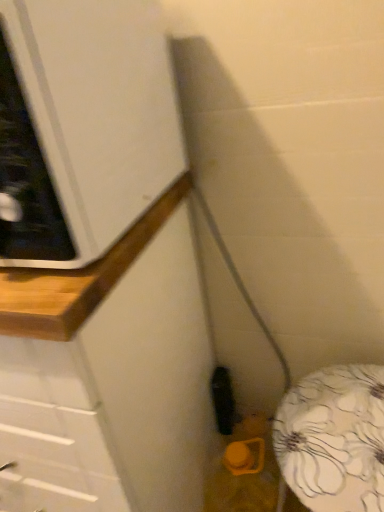
Describe the element at coordinates (109, 375) in the screenshot. I see `wooden counter at lower left` at that location.

Where is `wooden counter at lower left`? The width and height of the screenshot is (384, 512). wooden counter at lower left is located at coordinates pos(109,375).

At what (x,y) coordinates should I click in order to perform the action: click on white glossy cabinet at upper left. Please return your answer as a coordinate pair (x, y). Image resolution: width=384 pixels, height=512 pixels. Looking at the image, I should click on (81, 126).

Image resolution: width=384 pixels, height=512 pixels. What do you see at coordinates (81, 126) in the screenshot?
I see `white glossy cabinet at upper left` at bounding box center [81, 126].

The height and width of the screenshot is (512, 384). Find the location of `wooden counter at lower left`. wooden counter at lower left is located at coordinates (109, 375).

Does white glossy cabinet at upper left appear on the right side of wooden counter at lower left?

No.

Considering the positions of objects white glossy cabinet at upper left and wooden counter at lower left in the image provided, who is in front, white glossy cabinet at upper left or wooden counter at lower left?

white glossy cabinet at upper left.

Considering the points (26, 197) and (137, 500), which point is behind, point (26, 197) or point (137, 500)?

Positioned behind is point (137, 500).

From the image's perspective, between white glossy cabinet at upper left and wooden counter at lower left, which one is located above?

From the image's view, white glossy cabinet at upper left is above.

From a real-world perspective, who is located lower, white glossy cabinet at upper left or wooden counter at lower left?

From a 3D spatial view, wooden counter at lower left is below.

Between white glossy cabinet at upper left and wooden counter at lower left, which one has larger width?

wooden counter at lower left is wider.

Considering the relative sizes of white glossy cabinet at upper left and wooden counter at lower left in the image provided, is white glossy cabinet at upper left shorter than wooden counter at lower left?

Correct, white glossy cabinet at upper left is not as tall as wooden counter at lower left.

Can you confirm if white glossy cabinet at upper left is smaller than wooden counter at lower left?

Yes, white glossy cabinet at upper left is smaller than wooden counter at lower left.

Which is correct: white glossy cabinet at upper left is inside wooden counter at lower left, or outside of it?

The correct answer is: outside.

Is white glossy cabinet at upper left far from wooden counter at lower left?

Actually, white glossy cabinet at upper left and wooden counter at lower left are a little close together.

Could you tell me if white glossy cabinet at upper left is turned towards wooden counter at lower left?

No, white glossy cabinet at upper left is not facing towards wooden counter at lower left.

You are a GUI agent. You are given a task and a screenshot of the screen. Output one action in this format:
    pyautogui.click(x=<x>, y=<y>)
    Task: Click on the counter below the white glossy cabinet at upper left (from a real-world perspective)
    
    Given the screenshot: What is the action you would take?
    pyautogui.click(x=109, y=375)

Is wooden counter at lower left to the right of white glossy cabinet at upper left from the viewer's perspective?

Yes, wooden counter at lower left is to the right of white glossy cabinet at upper left.

Which is behind, wooden counter at lower left or white glossy cabinet at upper left?

wooden counter at lower left is further away from the camera.

Which is behind, point (139, 284) or point (141, 91)?

Positioned behind is point (139, 284).

From the image's perspective, is wooden counter at lower left on white glossy cabinet at upper left?

No, from the image's perspective, wooden counter at lower left is not on top of white glossy cabinet at upper left.

From a real-world perspective, is wooden counter at lower left below white glossy cabinet at upper left?

Correct, in the physical world, wooden counter at lower left is lower than white glossy cabinet at upper left.

From the picture: Can you confirm if wooden counter at lower left is thinner than white glossy cabinet at upper left?

No.

Considering the sizes of wooden counter at lower left and white glossy cabinet at upper left in the image, is wooden counter at lower left taller or shorter than white glossy cabinet at upper left?

Considering their sizes, wooden counter at lower left has more height than white glossy cabinet at upper left.

Considering the sizes of objects wooden counter at lower left and white glossy cabinet at upper left in the image provided, who is smaller, wooden counter at lower left or white glossy cabinet at upper left?

Smaller between the two is white glossy cabinet at upper left.

Is wooden counter at lower left inside the boundaries of white glossy cabinet at upper left, or outside?

wooden counter at lower left cannot be found inside white glossy cabinet at upper left.

Is wooden counter at lower left in contact with white glossy cabinet at upper left?

No, wooden counter at lower left is not with white glossy cabinet at upper left.

Is wooden counter at lower left facing towards white glossy cabinet at upper left?

No, wooden counter at lower left is not aimed at white glossy cabinet at upper left.

How different are the orientations of wooden counter at lower left and white glossy cabinet at upper left in degrees?

wooden counter at lower left and white glossy cabinet at upper left are facing 1.52 degrees away from each other.

Identify the location of counter behind the white glossy cabinet at upper left. (109, 375).

The height and width of the screenshot is (512, 384). Identify the location of cabinetry above the wooden counter at lower left (from a real-world perspective). (81, 126).

The image size is (384, 512). Find the location of `counter lying on the right of white glossy cabinet at upper left`. counter lying on the right of white glossy cabinet at upper left is located at coordinates (109, 375).